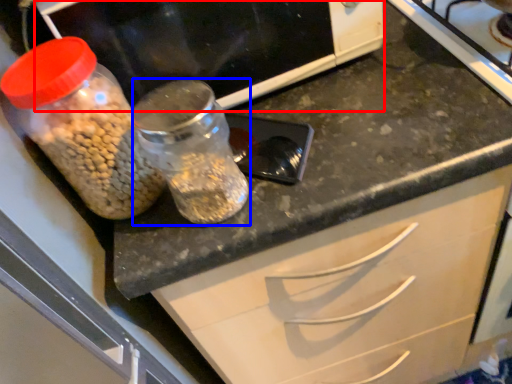
Question: Which object is closer to the camera taking this photo, wide (highlighted by a red box) or glass jar (highlighted by a blue box)?

Choices:
 (A) wide
 (B) glass jar

Answer: (B)